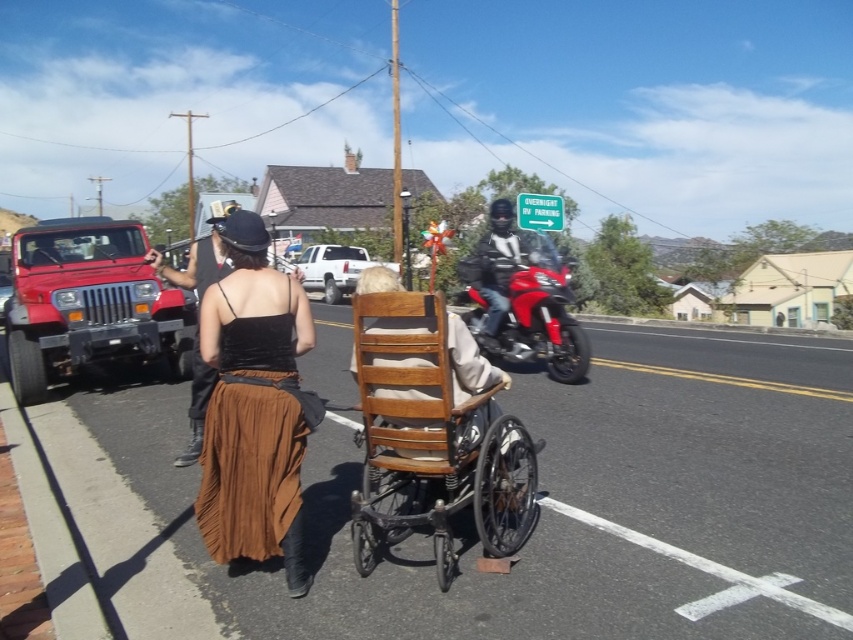
Looking at this image, you are a delivery person who needs to load a package onto the shiny red motorcycle at center. The package requires that it must be placed below the matte black hat at upper center. Can you place the package on the motorcycle without exceeding the height limit?

The shiny red motorcycle at center has a lesser height compared to matte black hat at upper center, so placing the package on the motorcycle would be below the height limit of the matte black hat at upper center. Therefore, the package can be placed there safely.

You are a fashion designer observing the scene. You need to determine which item is shorter between the brown suede skirt at center and the matte black hat at upper center. Which one is shorter?

The brown suede skirt at center is shorter than the matte black hat at upper center.